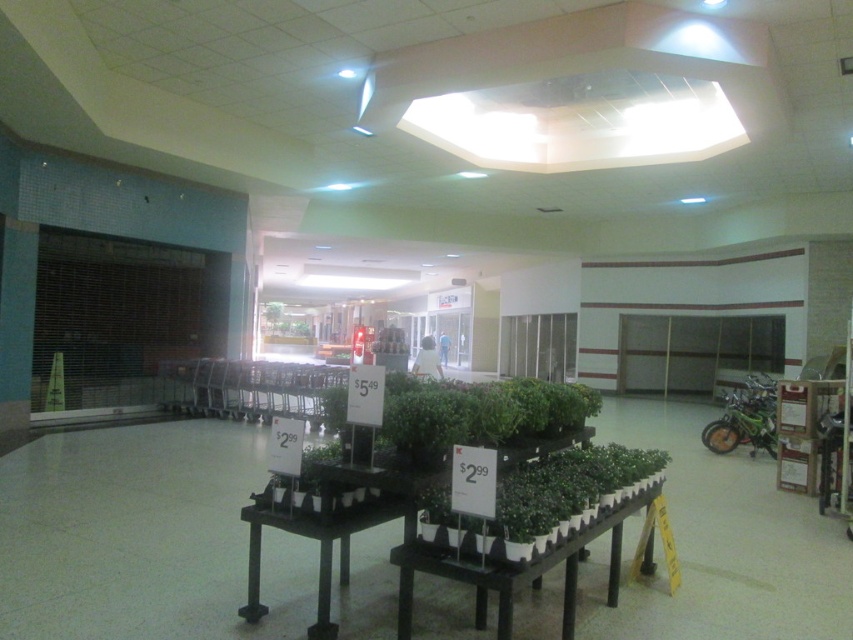
Which is behind, point (614, 552) or point (251, 580)?

Positioned behind is point (614, 552).

Does black matte table at center appear on the right side of black plastic table at center?

Correct, you'll find black matte table at center to the right of black plastic table at center.

This screenshot has height=640, width=853. Identify the location of black matte table at center. (517, 568).